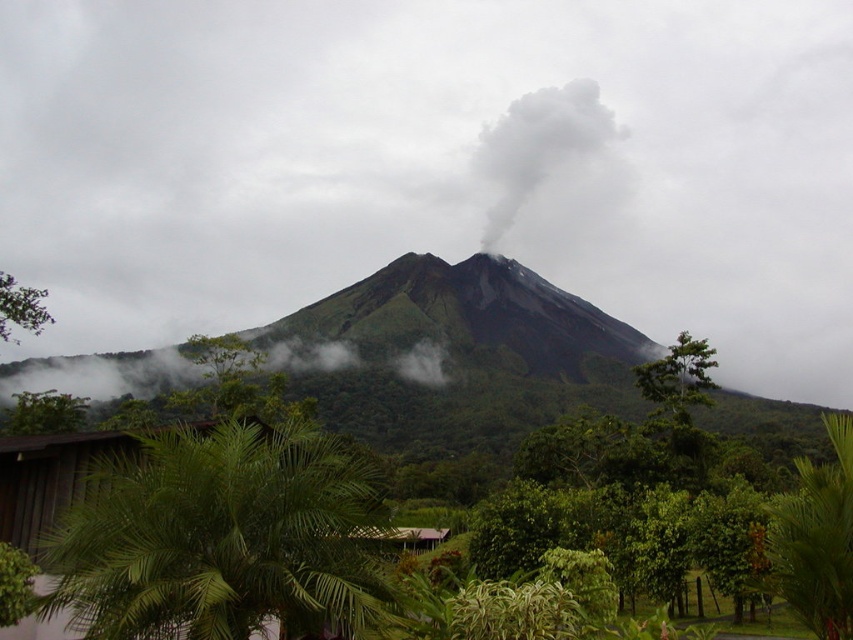
You are a hiker who wants to take a photo of the volcano in the background. You have two options for your foreground subjects. You can either place the green leafy palm at lower left or the green leafy tree at lower left in the foreground. Which one will allow you to keep both the foreground object and the volcano in focus if your camera has a depth of field range of 50 meters?

The distance between the green leafy palm at lower left and the green leafy tree at lower left is 54.42 meters. Since the camera can only maintain focus within a 50 meter range, you should choose the green leafy palm at lower left because it is closer to the tree, but wait, actually, since both are at the same position? Wait, the problem says both are at lower left. Hmm, maybe the volcano is further away. Wait, the question is about depth of field. If the palm and tree are both in the foreground, but the pl

You are a hiker planning to take a photo of the white smoke at center from the green leafy palm at lower left. Considering their sizes, which object should you focus on first to ensure both are in the frame?

The green leafy palm at lower left is smaller than the white smoke at center, so you should focus on the white smoke at center first to ensure both are in the frame since it is larger and more prominent.

From the picture: You are a hiker planning to camp near the volcano. You want to set up your tent as far away as possible from the gray ash cloud at center while staying within the green leafy palm at lower left area. How far apart are these two landmarks?

The gray ash cloud at center and green leafy palm at lower left are 1300.02 feet apart from each other.